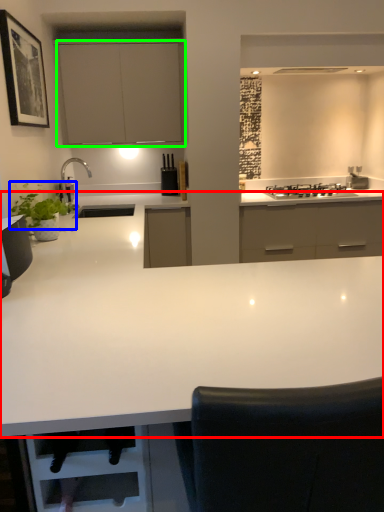
Question: Which is farther away from countertop (highlighted by a red box)? plant (highlighted by a blue box) or cabinetry (highlighted by a green box)?

Choices:
 (A) plant
 (B) cabinetry

Answer: (B)